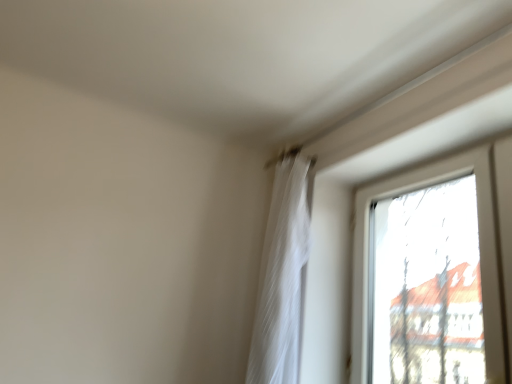
Question: Is point (253, 382) closer or farther from the camera than point (388, 183)?

Choices:
 (A) farther
 (B) closer

Answer: (B)

Question: Considering the positions of white sheer curtain at upper center and transparent glass window at upper right in the image, is white sheer curtain at upper center taller or shorter than transparent glass window at upper right?

Choices:
 (A) tall
 (B) short

Answer: (A)

Question: Based on their sizes in the image, would you say white sheer curtain at upper center is bigger or smaller than transparent glass window at upper right?

Choices:
 (A) small
 (B) big

Answer: (A)

Question: Is point pos(485,220) closer or farther from the camera than point pos(294,188)?

Choices:
 (A) closer
 (B) farther

Answer: (A)

Question: Considering the positions of transparent glass window at upper right and white sheer curtain at upper center in the image, is transparent glass window at upper right wider or thinner than white sheer curtain at upper center?

Choices:
 (A) wide
 (B) thin

Answer: (B)

Question: In the image, is transparent glass window at upper right positioned in front of or behind white sheer curtain at upper center?

Choices:
 (A) front
 (B) behind

Answer: (A)

Question: Do you think transparent glass window at upper right is within white sheer curtain at upper center, or outside of it?

Choices:
 (A) inside
 (B) outside

Answer: (B)